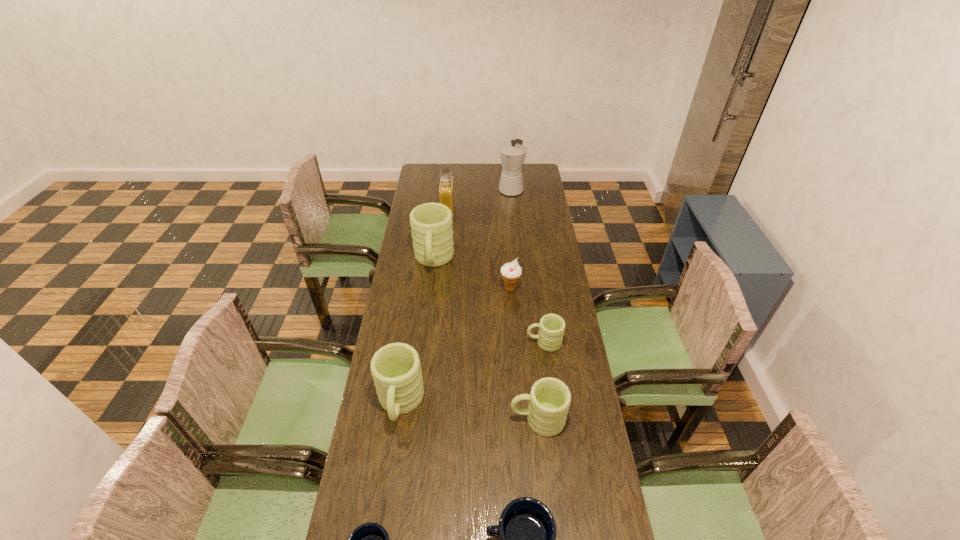
Locate an element on the screen. This screenshot has width=960, height=540. the farthest object is located at coordinates (513, 154).

You are a GUI agent. You are given a task and a screenshot of the screen. Output one action in this format:
    pyautogui.click(x=<x>, y=<y>)
    Task: Click on the tallest object
    The image size is (960, 540).
    Given the screenshot: What is the action you would take?
    pyautogui.click(x=513, y=154)

Image resolution: width=960 pixels, height=540 pixels. In order to click on the second farthest object in this screenshot , I will do `click(446, 186)`.

The width and height of the screenshot is (960, 540). Identify the location of the tallest mug. (431, 225).

Identify the location of the farthest green mug. (431, 225).

I want to click on the fifth shortest mug, so click(x=396, y=370).

Locate an element on the screen. The width and height of the screenshot is (960, 540). icecream is located at coordinates (511, 272).

This screenshot has width=960, height=540. Identify the location of the sixth nearest object. (511, 272).

Where is `the third biggest green mug`? The height and width of the screenshot is (540, 960). the third biggest green mug is located at coordinates (549, 400).

Locate an element on the screen. the fifth farthest object is located at coordinates (551, 328).